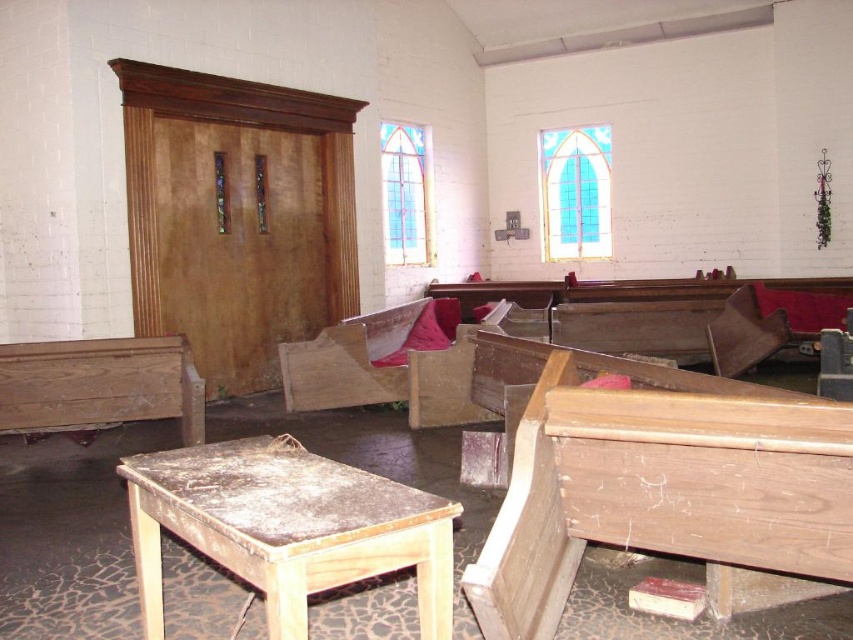
You are a maintenance worker in the church. You need to move the wooden bench at left to clean the area beneath it. Is the wooden table at lower left currently blocking that area?

The wooden table at lower left is positioned under the wooden bench at left, so the bench is above the table. To clean the area beneath the bench, you would need to move the bench first, but the table is already under it, so moving the bench might require moving the table out of the way first.

You are a maintenance worker needing to move a 5.5 meter long ladder from the wooden table at lower left to the wooden chair at right. Can you carry it through the space between them without tilting it?

The distance between the wooden table at lower left and wooden chair at right is 5.26 meters, which is shorter than the ladder length of 5.5 meters. Therefore, the ladder cannot be carried straight through the space between them without tilting.

You are a maintenance worker needing to move a 5 meter long ladder from the wooden bench at left to the wooden chair at right. Can you move it without tilting the ladder?

The wooden bench at left and wooden chair at right are 4.63 meters apart. Since the ladder is 5 meters long, it is longer than the distance between them. Therefore, you would need to tilt the ladder to move it through the space between the wooden bench at left and wooden chair at right.